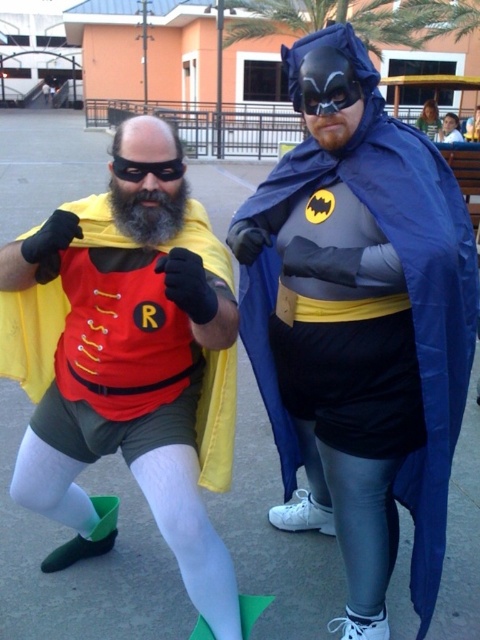
Can you confirm if matte red vest at center is shorter than smooth plastic cup at upper right?

Incorrect, matte red vest at center's height does not fall short of smooth plastic cup at upper right's.

Locate an element on the screen. The height and width of the screenshot is (640, 480). matte red vest at center is located at coordinates (x=130, y=362).

The width and height of the screenshot is (480, 640). What are the coordinates of `matte red vest at center` in the screenshot? It's located at (130, 362).

Between matte black cape at center and matte red vest at center, which one has more height?

With more height is matte black cape at center.

Does point (368, 497) come farther from viewer compared to point (112, 294)?

Yes, it is behind point (112, 294).

Locate an element on the screen. The width and height of the screenshot is (480, 640). matte black cape at center is located at coordinates (360, 324).

Can you confirm if matte black cape at center is wider than smooth plastic cup at upper right?

Correct, the width of matte black cape at center exceeds that of smooth plastic cup at upper right.

Is point (307, 352) positioned before point (433, 113)?

Yes, point (307, 352) is closer to viewer.

At what (x,y) coordinates should I click in order to perform the action: click on matte black cape at center. Please return your answer as a coordinate pair (x, y). This screenshot has height=640, width=480. Looking at the image, I should click on (360, 324).